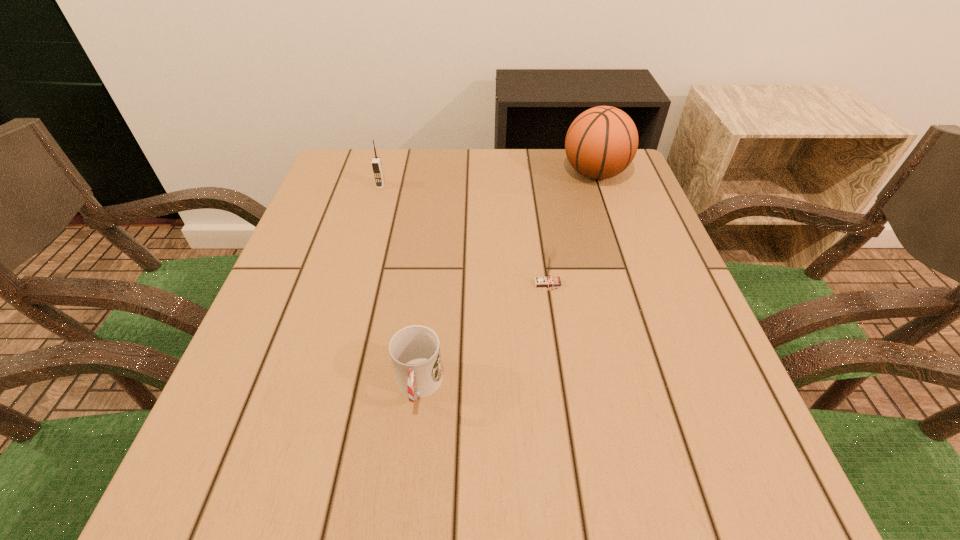
The image size is (960, 540). Identify the location of basketball. (601, 142).

Where is `the tallest object`? The width and height of the screenshot is (960, 540). the tallest object is located at coordinates (601, 142).

At what (x,y) coordinates should I click in order to perform the action: click on the second tallest object. Please return your answer as a coordinate pair (x, y). This screenshot has height=540, width=960. Looking at the image, I should click on (376, 162).

Where is `cellular telephone`? The image size is (960, 540). cellular telephone is located at coordinates (376, 162).

The width and height of the screenshot is (960, 540). Find the location of `the second nearest object`. the second nearest object is located at coordinates (547, 280).

What are the coordinates of `the third object from left to right` in the screenshot? It's located at (547, 280).

Image resolution: width=960 pixels, height=540 pixels. I want to click on the second object from left to right, so click(415, 350).

The height and width of the screenshot is (540, 960). In order to click on cup in this screenshot , I will do `click(415, 350)`.

Where is `free spot located 0.210m on the front of the basketball`? free spot located 0.210m on the front of the basketball is located at coordinates (620, 248).

The width and height of the screenshot is (960, 540). Find the location of `free point located on the front-facing side of the second tallest object`. free point located on the front-facing side of the second tallest object is located at coordinates 359,263.